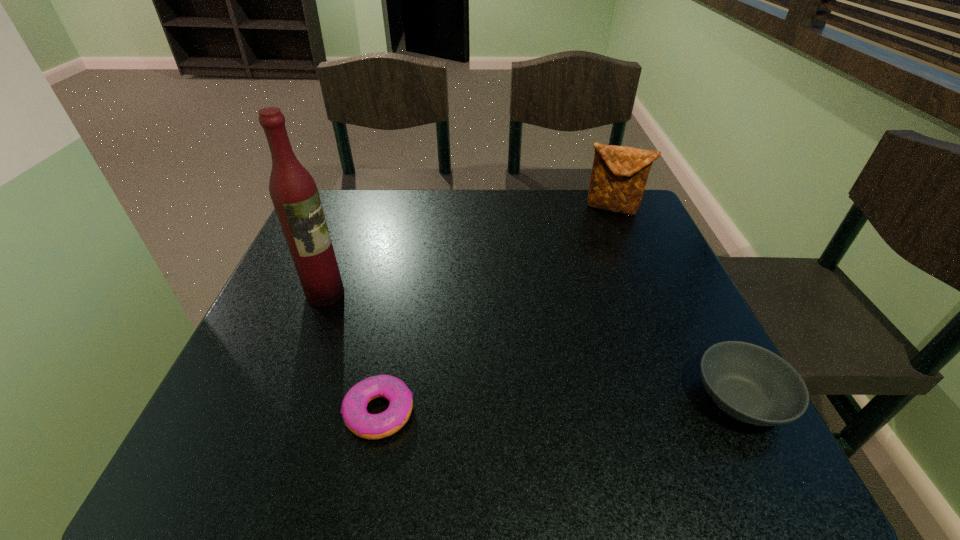
Find the location of a particular element. This screenshot has height=540, width=960. vacant space situated on the label of the third nearest object is located at coordinates (495, 389).

Find the location of a particular element. The image size is (960, 540). free space located on the label of the third nearest object is located at coordinates (441, 358).

Where is `free location located on the open side of the clutch bag`? The height and width of the screenshot is (540, 960). free location located on the open side of the clutch bag is located at coordinates (563, 303).

Locate an element on the screen. The image size is (960, 540). vacant area situated on the open side of the clutch bag is located at coordinates (568, 291).

This screenshot has height=540, width=960. Identify the location of free space located on the open side of the clutch bag. (561, 306).

Find the location of a particular element. object that is at the far edge is located at coordinates (619, 175).

The width and height of the screenshot is (960, 540). Identify the location of doughnut at the near edge. (363, 424).

This screenshot has width=960, height=540. I want to click on soup bowl at the near edge, so click(x=749, y=383).

Where is `object present at the left edge`? Image resolution: width=960 pixels, height=540 pixels. object present at the left edge is located at coordinates (293, 191).

Find the location of a particular element. Image resolution: width=960 pixels, height=540 pixels. soup bowl that is positioned at the right edge is located at coordinates (749, 383).